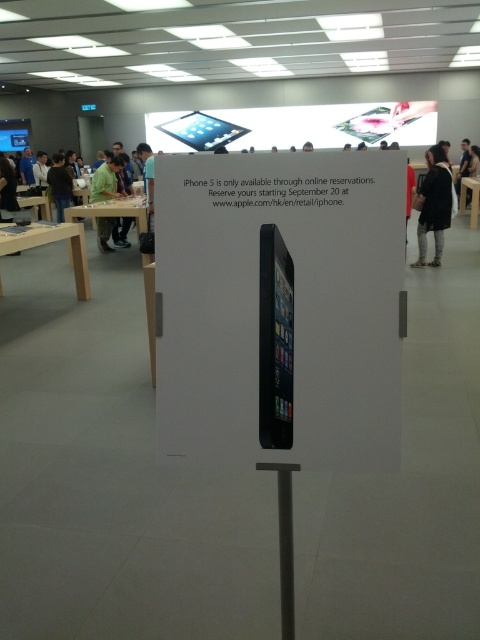
You are a customer looking to purchase a new shirt and see the black fabric at upper right and the green fabric shirt at center in the store. Which fabric item is bigger in size?

The black fabric at upper right is larger in size than the green fabric shirt at center.